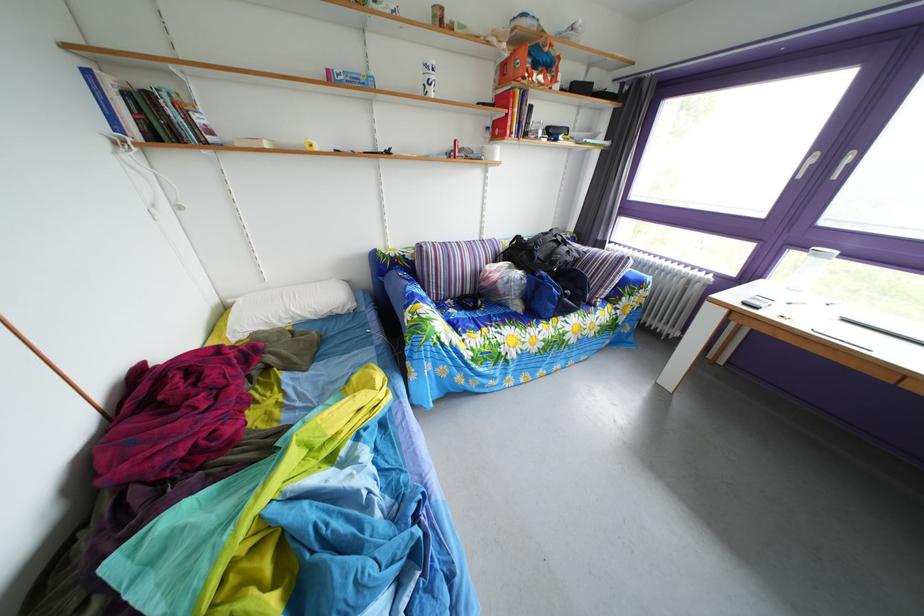
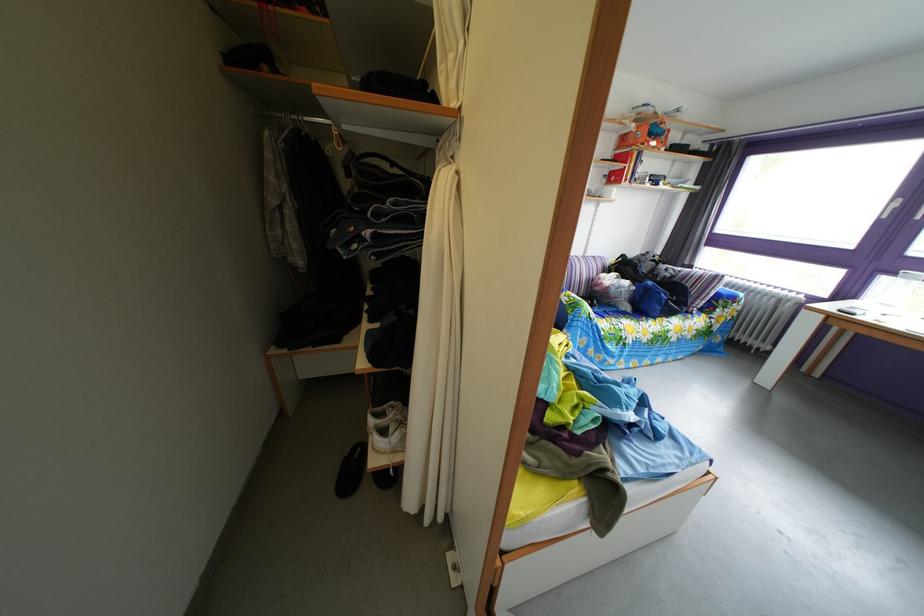
Locate, in the second image, the point that corresponds to point (529, 315) in the first image.

(638, 315)